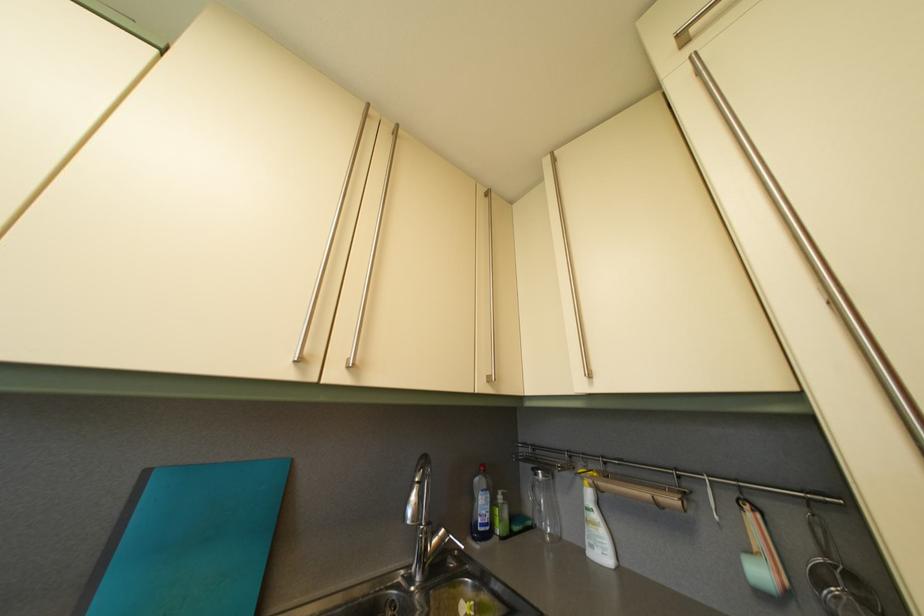
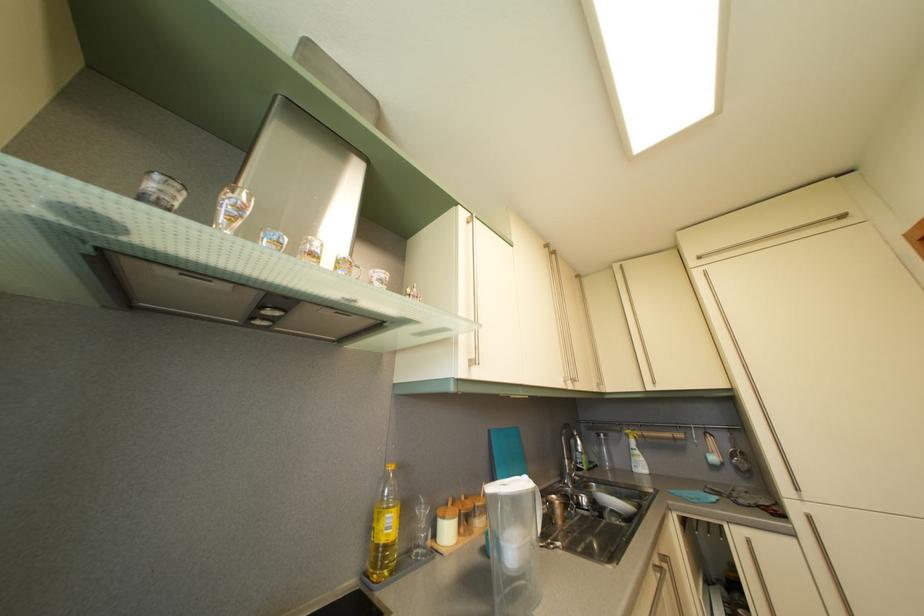
The point at (544, 482) is marked in the first image. Where is the corresponding point in the second image?

(608, 444)